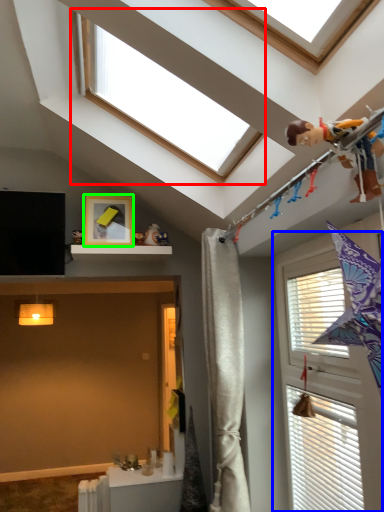
Question: Based on their relative distances, which object is farther from window (highlighted by a red box)? Choose from window (highlighted by a blue box) and picture frame (highlighted by a green box).

Choices:
 (A) window
 (B) picture frame

Answer: (A)